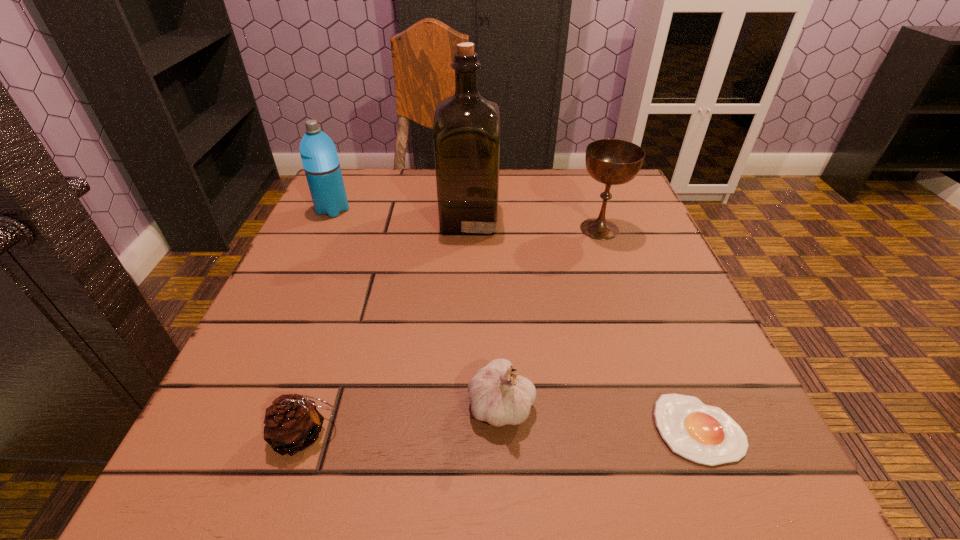
Locate an element on the screen. This screenshot has width=960, height=540. free point between the thermos bottle and the third shortest object is located at coordinates (417, 307).

The width and height of the screenshot is (960, 540). What are the coordinates of `free space between the garlic and the leftmost object` in the screenshot? It's located at (417, 307).

Select which object is the closest to the fourth tallest object. Please provide its 2D coordinates. Your answer should be formatted as a tuple, i.e. [(x, y)], where the tuple contains the x and y coordinates of a point satisfying the conditions above.

[(705, 434)]

Where is `the fifth closest object to the liquor`? The image size is (960, 540). the fifth closest object to the liquor is located at coordinates (x=705, y=434).

Identify the location of blank space that satisfies the following two spatial constraints: 1. on the label of the chalice; 2. on the left side of the liquor. (468, 229).

Where is `vacant space that satisfies the following two spatial constraints: 1. on the label of the tallest object; 2. on the back side of the chalice`? This screenshot has width=960, height=540. vacant space that satisfies the following two spatial constraints: 1. on the label of the tallest object; 2. on the back side of the chalice is located at coordinates (468, 229).

Where is `free space in the image that satisfies the following two spatial constraints: 1. on the label of the tallest object; 2. on the back side of the chalice`? The height and width of the screenshot is (540, 960). free space in the image that satisfies the following two spatial constraints: 1. on the label of the tallest object; 2. on the back side of the chalice is located at coordinates (468, 229).

Locate an element on the screen. Image resolution: width=960 pixels, height=540 pixels. vacant area that satisfies the following two spatial constraints: 1. on the label of the garlic; 2. on the left side of the liquor is located at coordinates (463, 405).

Where is `free space that satisfies the following two spatial constraints: 1. on the front side of the fourth tallest object; 2. on the right side of the leftmost object`? The image size is (960, 540). free space that satisfies the following two spatial constraints: 1. on the front side of the fourth tallest object; 2. on the right side of the leftmost object is located at coordinates (242, 405).

Locate an element on the screen. Image resolution: width=960 pixels, height=540 pixels. vacant space that satisfies the following two spatial constraints: 1. on the front side of the chalice; 2. with a leaf charm attached to the second shortest object is located at coordinates (672, 435).